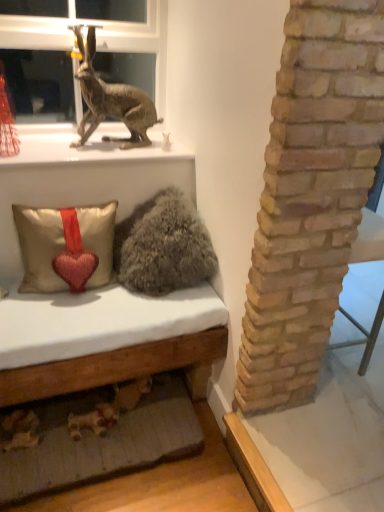
Locate an element on the screen. This screenshot has height=512, width=384. vacant area that lies between satin beige pillow with heart at lower left and fuzzy gray pillow at center is located at coordinates (87, 307).